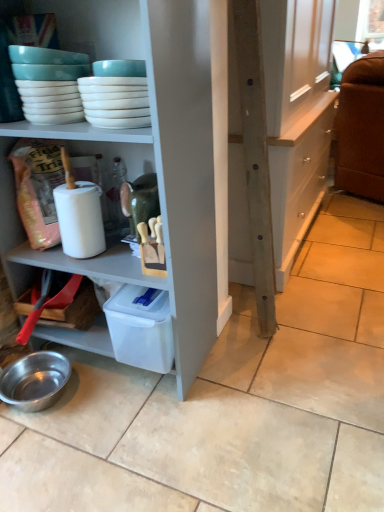
Identify the location of free spot below shiny metallic bowl at lower left (from a real-world perspective). (52, 396).